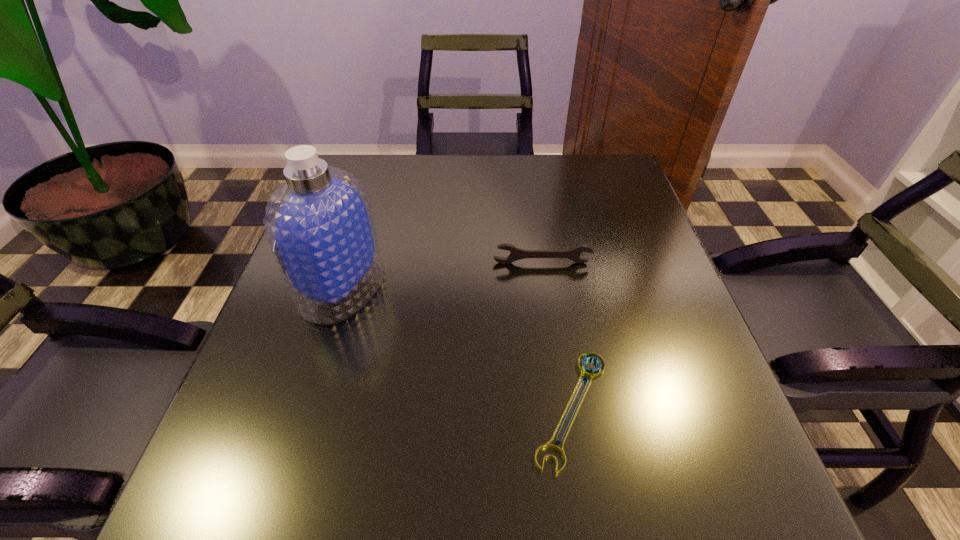
This screenshot has width=960, height=540. Find the location of `vacant space that's between the farther wrench and the shortest object`. vacant space that's between the farther wrench and the shortest object is located at coordinates (557, 336).

The image size is (960, 540). Identify the location of free space between the farther wrench and the nearest object. (557, 336).

This screenshot has width=960, height=540. In order to click on free space that is in between the leftmost object and the nearest object in this screenshot , I will do `click(457, 348)`.

At what (x,y) coordinates should I click in order to perform the action: click on free space between the tallest object and the farther wrench. Please return your answer as a coordinate pair (x, y). The image size is (960, 540). Looking at the image, I should click on (443, 275).

At what (x,y) coordinates should I click in order to perform the action: click on free spot between the leftmost object and the second shortest object. Please return your answer as a coordinate pair (x, y). This screenshot has width=960, height=540. Looking at the image, I should click on (443, 275).

This screenshot has height=540, width=960. I want to click on free spot between the tallest object and the taller wrench, so click(443, 275).

You are a GUI agent. You are given a task and a screenshot of the screen. Output one action in this format:
    pyautogui.click(x=<x>, y=<y>)
    Task: Click on the object that is the second closest to the farther wrench
    Image resolution: width=960 pixels, height=540 pixels.
    Given the screenshot: What is the action you would take?
    pyautogui.click(x=589, y=372)

This screenshot has width=960, height=540. In order to click on object that ranks as the closest to the second tallest object in this screenshot , I will do `click(319, 224)`.

This screenshot has width=960, height=540. Identify the location of vacant area that satisfies the following two spatial constraints: 1. on the open ends of the second tallest object; 2. on the left side of the nearest object. (563, 409).

You are a GUI agent. You are given a task and a screenshot of the screen. Output one action in this format:
    pyautogui.click(x=<x>, y=<y>)
    Task: Click on the vacant position in the image that satisfies the following two spatial constraints: 1. on the open ends of the farther wrench; 2. on the right side of the shortest object
    The image size is (960, 540).
    Given the screenshot: What is the action you would take?
    pyautogui.click(x=563, y=409)